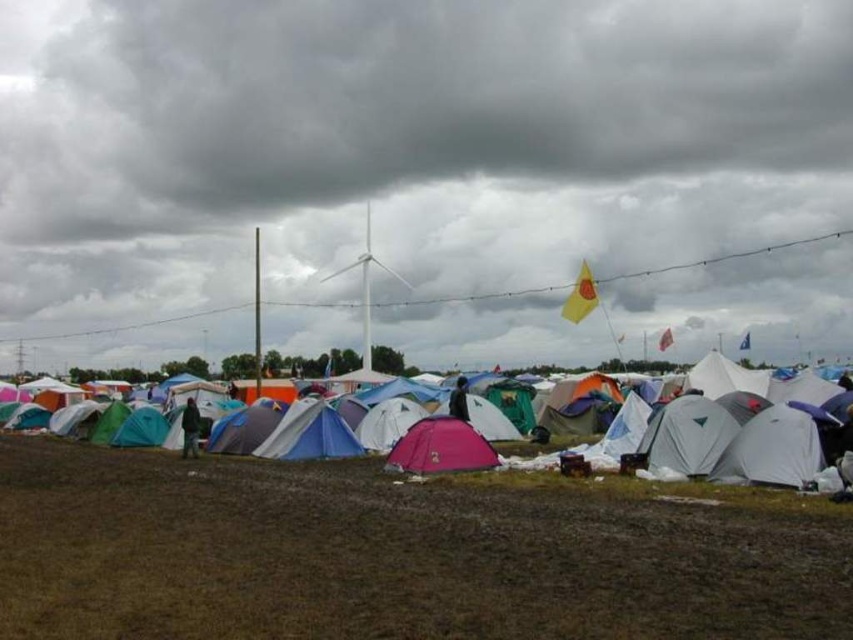
You are a camper who just arrived at the camping area. You see the brown grassy field at lower center and the pink fabric tent at center. Which object is positioned higher in the image?

The brown grassy field at lower center is located above the pink fabric tent at center, so it is positioned higher in the image.

You are a photographer trying to capture the entire camping area. You notice two specific points in the image at coordinates point (619, 547) and point (368, 282). Which of these points is positioned closer to your camera lens?

Point (619, 547) is closer to the camera than point (368, 282).